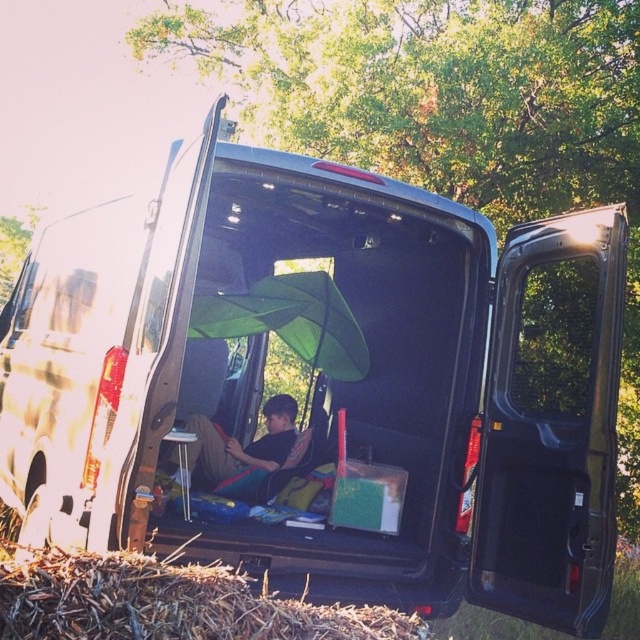
Question: Which point appears farthest from the camera in this image?

Choices:
 (A) (268, 460)
 (B) (150, 614)

Answer: (A)

Question: Does brown straw at lower left have a larger size compared to black fabric at center?

Choices:
 (A) no
 (B) yes

Answer: (A)

Question: Is brown straw at lower left bigger than black fabric at center?

Choices:
 (A) yes
 (B) no

Answer: (B)

Question: Which object appears closest to the camera in this image?

Choices:
 (A) black fabric at center
 (B) brown straw at lower left

Answer: (B)

Question: Does brown straw at lower left have a lesser width compared to black fabric at center?

Choices:
 (A) yes
 (B) no

Answer: (B)